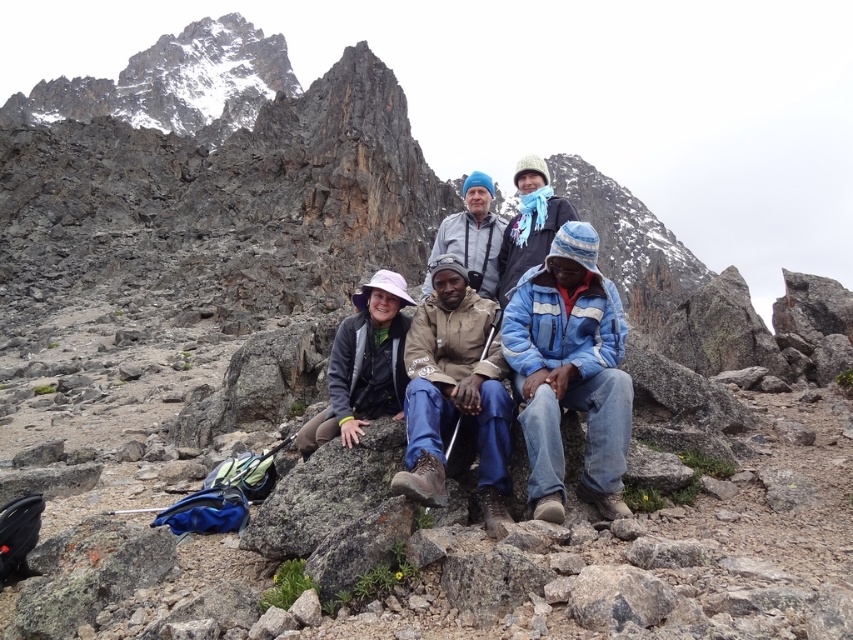
Question: Does brown leather jacket at center have a lesser width compared to blue knitted hat at upper center?

Choices:
 (A) yes
 (B) no

Answer: (A)

Question: Among these objects, which one is nearest to the camera?

Choices:
 (A) brown leather jacket at center
 (B) blue knitted hat at upper center
 (C) blue knit cap at center

Answer: (A)

Question: Is blue fleece jacket at center thinner than brown leather jacket at center?

Choices:
 (A) yes
 (B) no

Answer: (B)

Question: Can you confirm if pink fabric hat at lower left is smaller than blue knit cap at center?

Choices:
 (A) no
 (B) yes

Answer: (B)

Question: Which of the following is the closest to the observer?

Choices:
 (A) (410, 404)
 (B) (480, 268)

Answer: (A)

Question: Based on their relative distances, which object is nearer to the brown leather jacket at center?

Choices:
 (A) blue knitted hat at upper center
 (B) blue fleece jacket at center
 (C) pink fabric hat at lower left

Answer: (B)